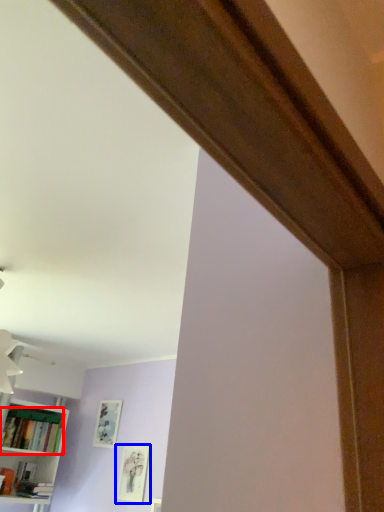
Question: Which object appears farthest to the camera in this image, book (highlighted by a red box) or picture frame (highlighted by a blue box)?

Choices:
 (A) book
 (B) picture frame

Answer: (A)